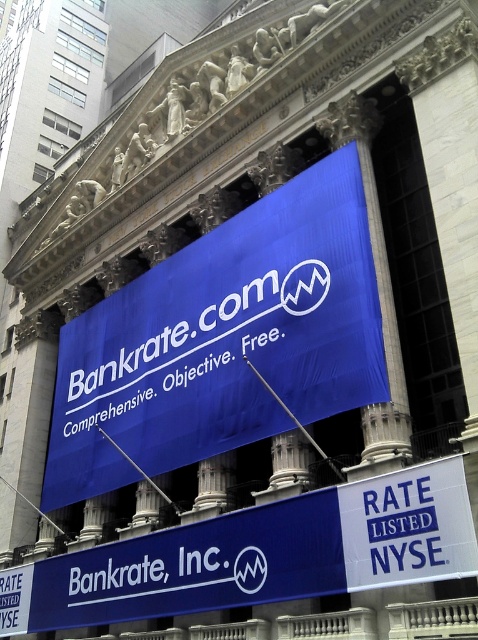
You are a window cleaner working on the NYSE building. You need to clean both the blue fabric banner at center and the blue matte banner at center. Which banner will require you to climb higher to reach?

The blue fabric banner at center is much taller than the blue matte banner at center, so you will need to climb higher to reach the blue fabric banner at center.